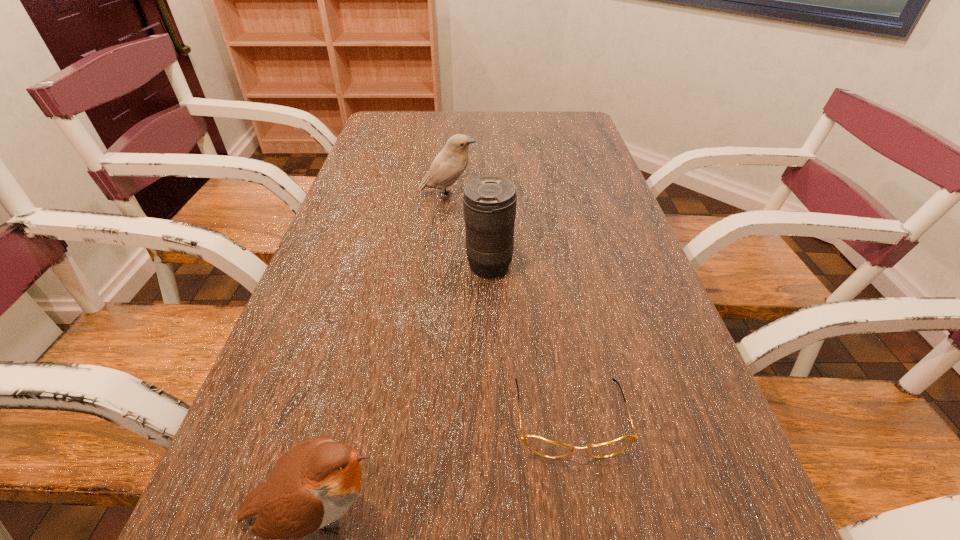
Image resolution: width=960 pixels, height=540 pixels. Identify the location of free space at the far edge of the desktop. pyautogui.click(x=472, y=118).

In the image, there is a desktop. Where is `vacant space at the left edge`? The height and width of the screenshot is (540, 960). vacant space at the left edge is located at coordinates tap(326, 261).

Image resolution: width=960 pixels, height=540 pixels. What are the coordinates of `free region at the right edge` in the screenshot? It's located at (623, 305).

This screenshot has width=960, height=540. I want to click on free space at the far right corner, so click(576, 136).

Locate an element on the screen. The image size is (960, 540). vacant space that's between the second farthest object and the second nearest object is located at coordinates (529, 342).

Identify the location of empty location between the spectacles and the telephoto lens. (529, 342).

Locate an element on the screen. The width and height of the screenshot is (960, 540). vacant point located between the farthest object and the shortest object is located at coordinates (509, 307).

Image resolution: width=960 pixels, height=540 pixels. I want to click on empty space between the shortest object and the farther bird, so click(509, 307).

I want to click on the closest object relative to the nearer bird, so click(x=543, y=447).

This screenshot has width=960, height=540. Find the location of `object that stands as the second closest to the second farthest object`. object that stands as the second closest to the second farthest object is located at coordinates (543, 447).